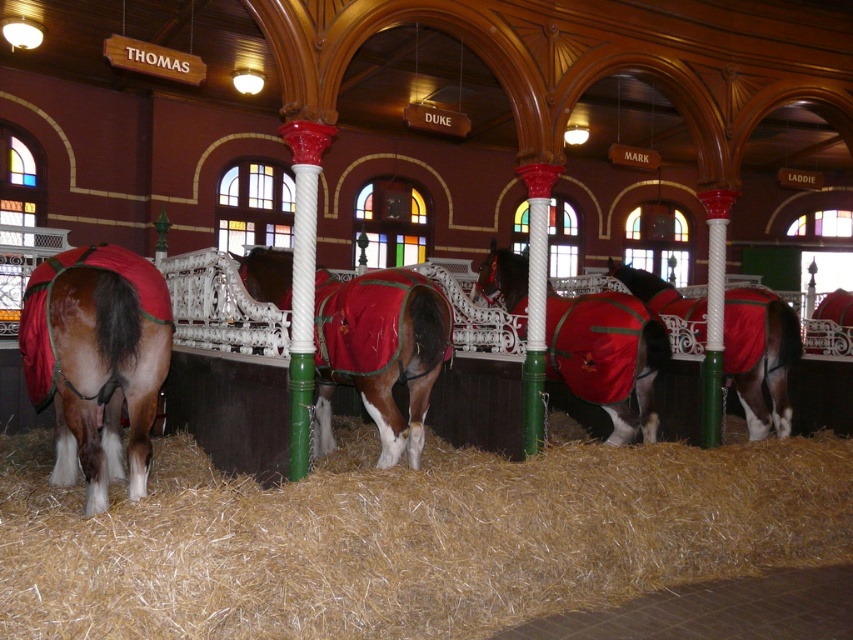
Question: Based on their relative distances, which object is farther from the golden straw at lower center?

Choices:
 (A) shiny brown horse at center
 (B) brown glossy horse at center
 (C) shiny red blanket at center
 (D) shiny brown horse at left

Answer: (A)

Question: Is shiny red blanket at center to the left of shiny brown horse at center from the viewer's perspective?

Choices:
 (A) yes
 (B) no

Answer: (A)

Question: Among these objects, which one is farthest from the camera?

Choices:
 (A) golden straw at lower center
 (B) brown glossy horse at center

Answer: (B)

Question: Can you confirm if golden straw at lower center is smaller than shiny brown horse at center?

Choices:
 (A) yes
 (B) no

Answer: (B)

Question: Which object is closer to the camera taking this photo?

Choices:
 (A) shiny brown horse at left
 (B) shiny brown horse at center
 (C) brown glossy horse at center
 (D) shiny red blanket at center

Answer: (A)

Question: Is shiny brown horse at left thinner than shiny red blanket at center?

Choices:
 (A) no
 (B) yes

Answer: (A)